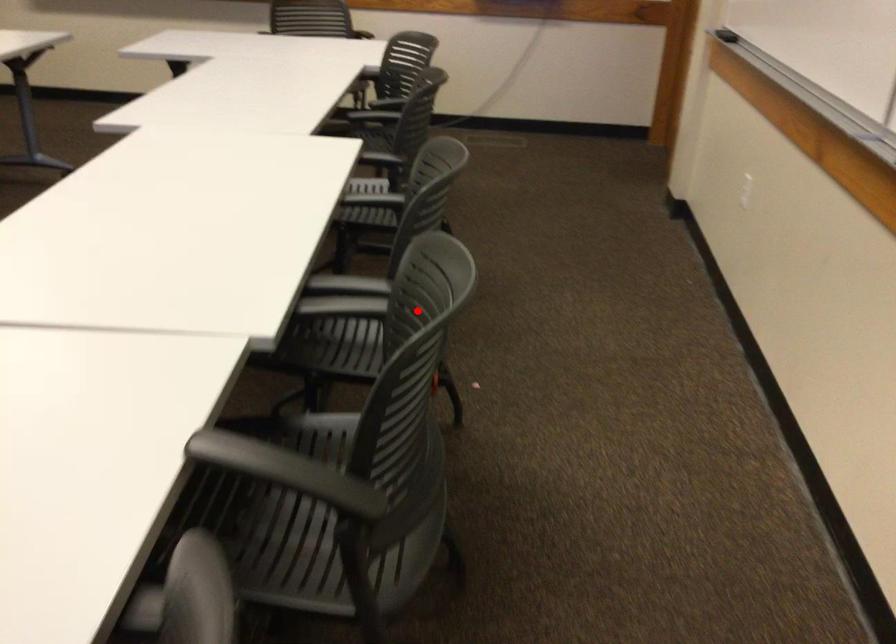
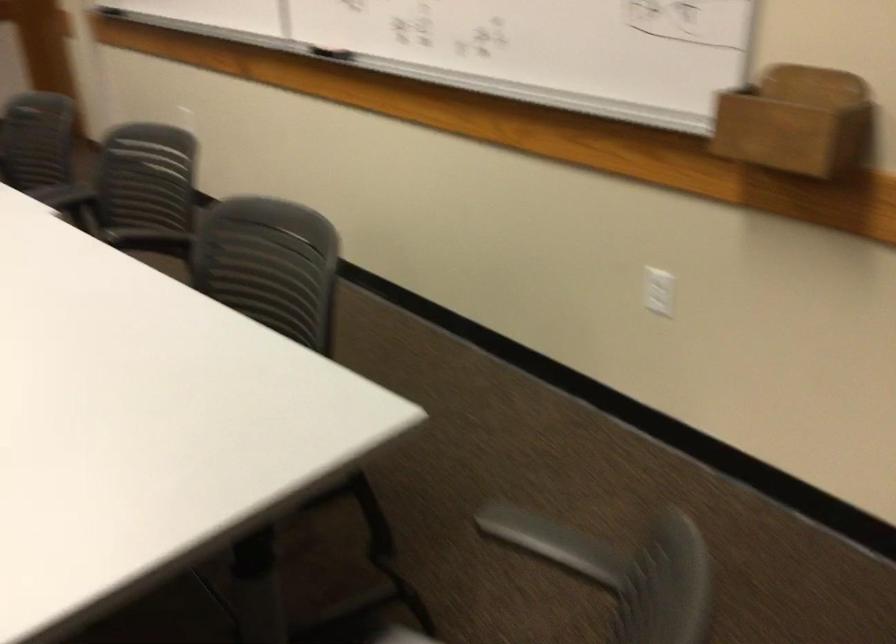
Question: I am providing you with two images of the same scene from different viewpoints. Given a red point in image1, look at the same physical point in image2. Is it:

Choices:
 (A) Closer to the viewpoint
 (B) Farther from the viewpoint

Answer: (B)